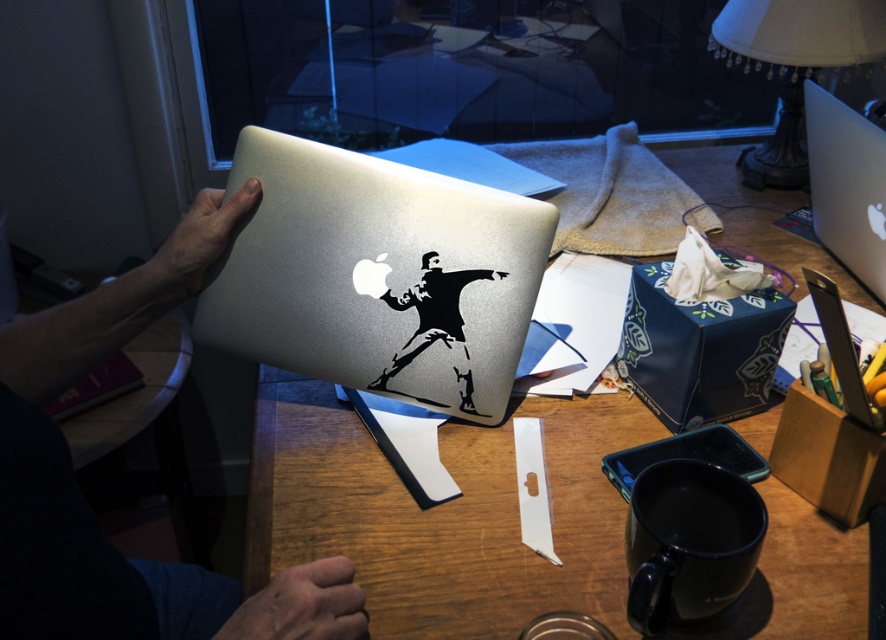
Is satin silver laptop at center in front of white fabric lampshade at upper right?

Yes, it is.

Does satin silver laptop at center appear under white fabric lampshade at upper right?

Correct, satin silver laptop at center is located below white fabric lampshade at upper right.

Is point (395, 173) positioned after point (833, 1)?

No, (395, 173) is in front of (833, 1).

You are a GUI agent. You are given a task and a screenshot of the screen. Output one action in this format:
    pyautogui.click(x=<x>, y=<y>)
    Task: Click on the satin silver laptop at center
    
    Given the screenshot: What is the action you would take?
    pyautogui.click(x=378, y=275)

Between wooden table at center and metallic silver laptop at upper center, which one appears on the right side from the viewer's perspective?

From the viewer's perspective, wooden table at center appears more on the right side.

You are a GUI agent. You are given a task and a screenshot of the screen. Output one action in this format:
    pyautogui.click(x=<x>, y=<y>)
    Task: Click on the wooden table at center
    
    Given the screenshot: What is the action you would take?
    pyautogui.click(x=441, y=513)

Find the location of a particular element. The height and width of the screenshot is (640, 886). wooden table at center is located at coordinates (441, 513).

Can you confirm if satin silver laptop at center is shorter than metallic silver laptop at upper center?

Yes, satin silver laptop at center is shorter than metallic silver laptop at upper center.

Does point (239, 330) come farther from viewer compared to point (105, 323)?

That is True.

I want to click on satin silver laptop at center, so click(x=378, y=275).